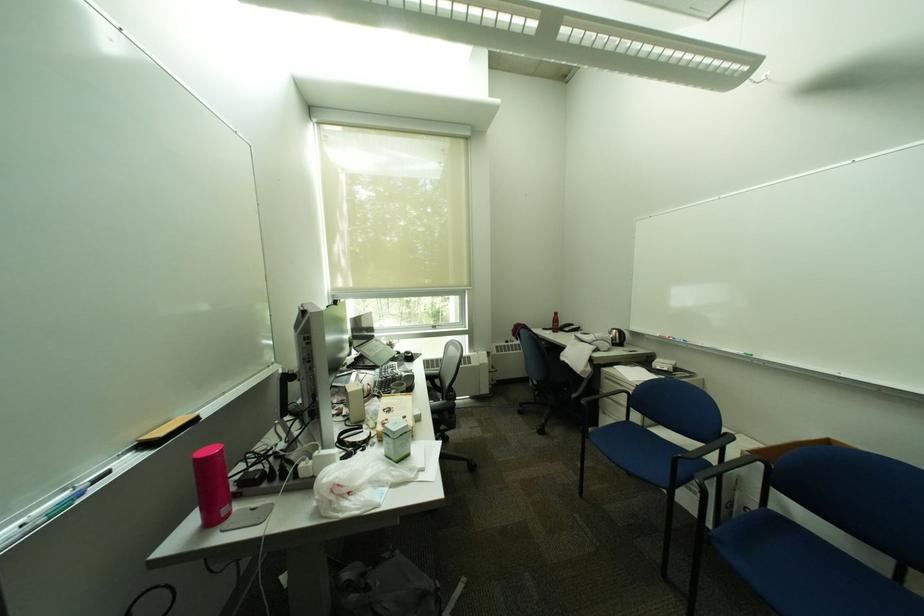
Describe the element at coordinates (212, 485) in the screenshot. I see `a red water bottle` at that location.